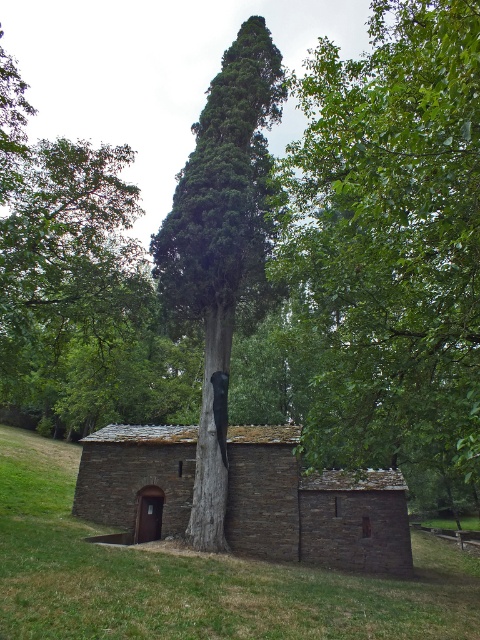
Question: Is green textured tree at center to the right of green rough bark tree trunk at center from the viewer's perspective?

Choices:
 (A) yes
 (B) no

Answer: (A)

Question: Can you confirm if stone hut at center is positioned above green textured tree at center?

Choices:
 (A) no
 (B) yes

Answer: (A)

Question: Which of the following is the farthest from the observer?

Choices:
 (A) (117, 440)
 (B) (255, 109)
 (C) (213, 362)

Answer: (B)

Question: Is stone hut at center to the right of green rough bark tree trunk at center from the viewer's perspective?

Choices:
 (A) no
 (B) yes

Answer: (B)

Question: Estimate the real-world distances between objects in this image. Which object is closer to the stone hut at center?

Choices:
 (A) green rough bark tree trunk at center
 (B) green leafy tree at center
 (C) green textured tree at center

Answer: (A)

Question: Considering the real-world distances, which object is farthest from the stone hut at center?

Choices:
 (A) green rough bark tree trunk at center
 (B) green leafy tree at center

Answer: (B)